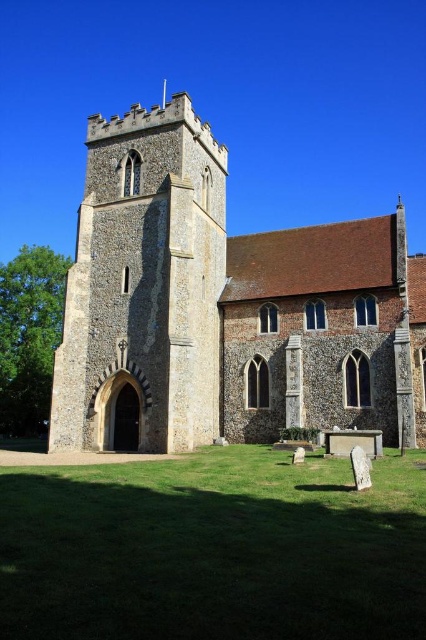
You are standing in front of the historic stone church and want to take a photo of the stone tower at center and the stone tower at left. Which tower should you focus on first if you want to capture both in a single frame without moving the camera?

The stone tower at center is positioned over the stone tower at left, so you should focus on the stone tower at left first to ensure it is fully visible beneath the stone tower at center in the frame.

You are standing in front of the historic stone church and want to locate the point at coordinates point (x=224, y=307). Based on the scene description, where exactly is this point located?

The point (x=224, y=307) is on the stone tower at center.

You are standing in front of the church and want to take a photo that includes both the stone tower at center and the stone tower at left. However, you notice that one of them is blocking the view of the other. Which tower is blocking the other one?

The stone tower at left is behind stone tower at center, so the stone tower at center is blocking the view of the stone tower at left.